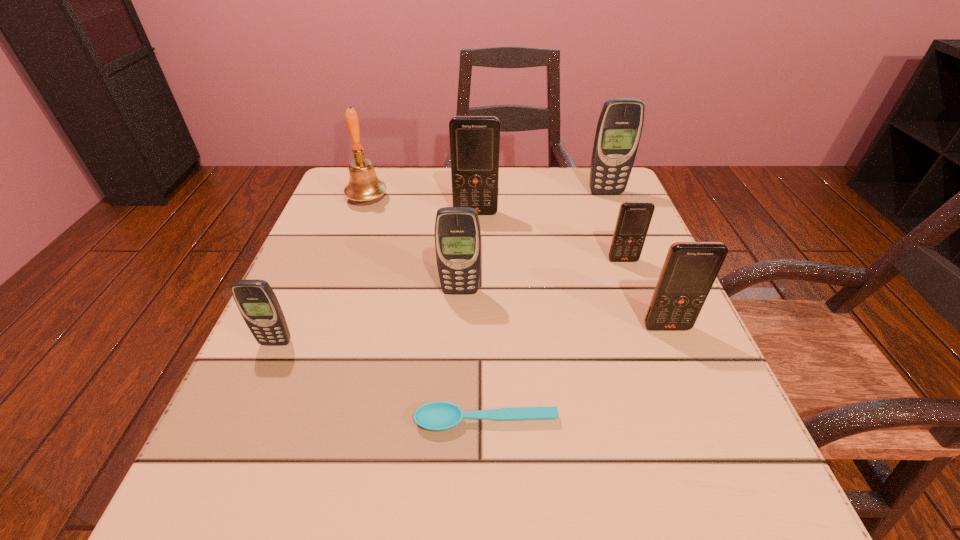
At what (x,y) coordinates should I click in order to perform the action: click on the leftmost orange cellular telephone. Please return your answer as a coordinate pair (x, y). Looking at the image, I should click on click(x=474, y=140).

I want to click on the biggest orange cellular telephone, so click(x=474, y=140).

Image resolution: width=960 pixels, height=540 pixels. Find the location of `the farthest cellular telephone`. the farthest cellular telephone is located at coordinates (619, 128).

Identify the location of the biggest gray cellular telephone. (619, 128).

At what (x,y) coordinates should I click in order to perform the action: click on bell. Please return your answer as a coordinate pair (x, y). This screenshot has width=960, height=540. Looking at the image, I should click on (364, 185).

Where is `the second nearest gray cellular telephone`? the second nearest gray cellular telephone is located at coordinates (457, 231).

Image resolution: width=960 pixels, height=540 pixels. I want to click on the second biggest gray cellular telephone, so click(x=457, y=231).

Find the location of `the nearest orange cellular telephone`. the nearest orange cellular telephone is located at coordinates (690, 268).

I want to click on the third nearest object, so click(x=690, y=268).

Locate an element on the screen. The height and width of the screenshot is (540, 960). the smallest orange cellular telephone is located at coordinates (634, 218).